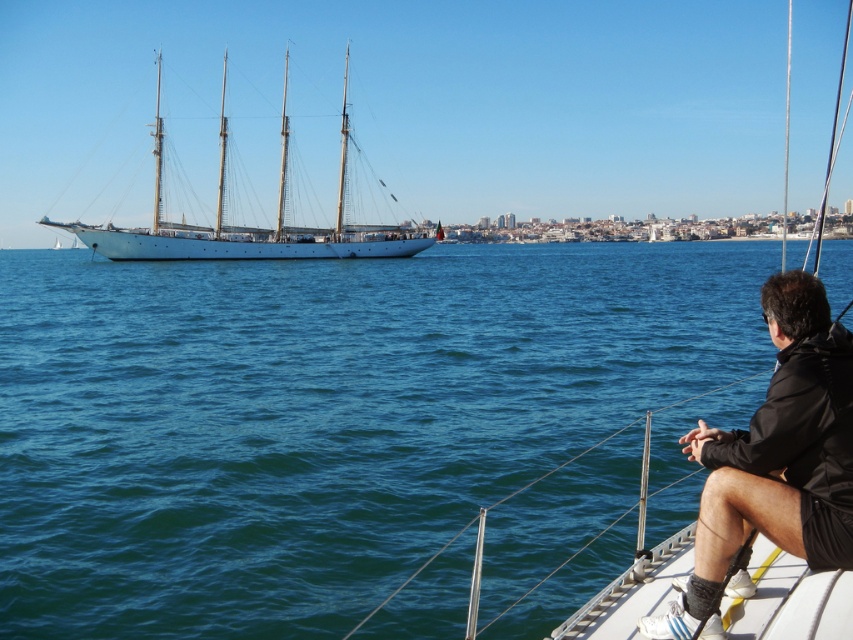
Looking at this image, you are a photographer trying to capture a shot of the blue water at left and the black matte jacket at lower right. Which object will occupy more space in your photo?

The blue water at left occupies more space in the photo because it is bigger than the black matte jacket at lower right.

You are standing on the white polished wood sailboat at left and want to reach the blue water at left. Given that the distance between them is 59.83 feet, is this distance safe for a 60 feet long boat to maneuver through?

The blue water at left is 59.83 feet away from the white polished wood sailboat at left. Since the boat is 60 feet long, the distance is slightly shorter than the boat, so it might not be safe to maneuver through as there could be insufficient space.